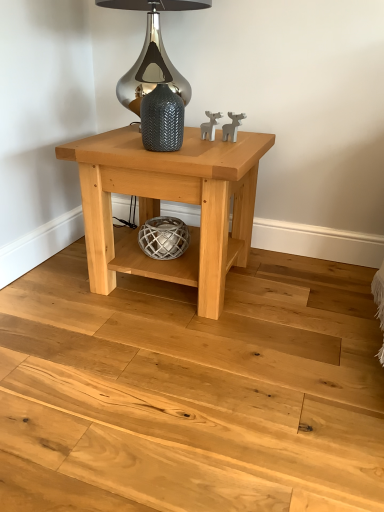
Find the location of a particular element. The image size is (384, 512). free spot to the right of natural wood table at center is located at coordinates (304, 298).